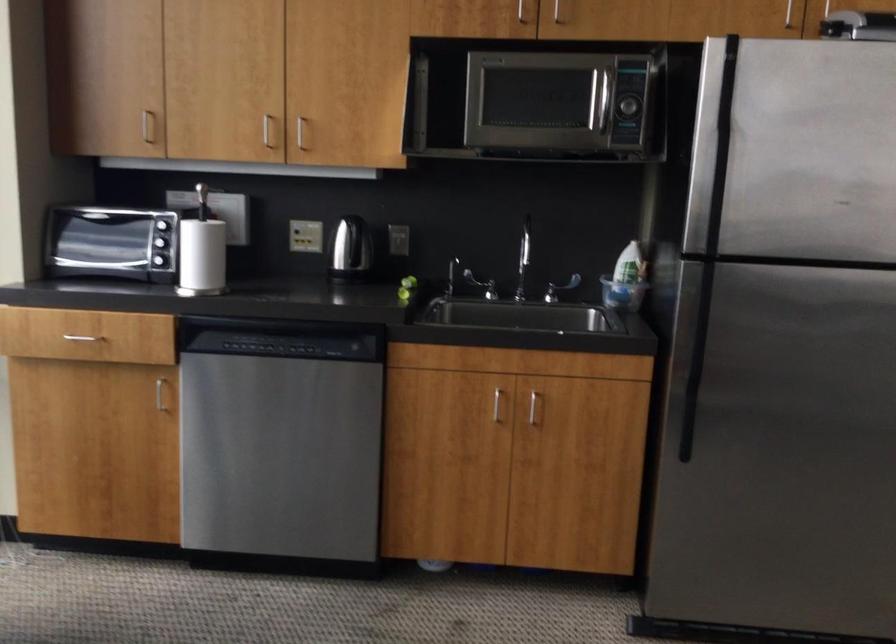
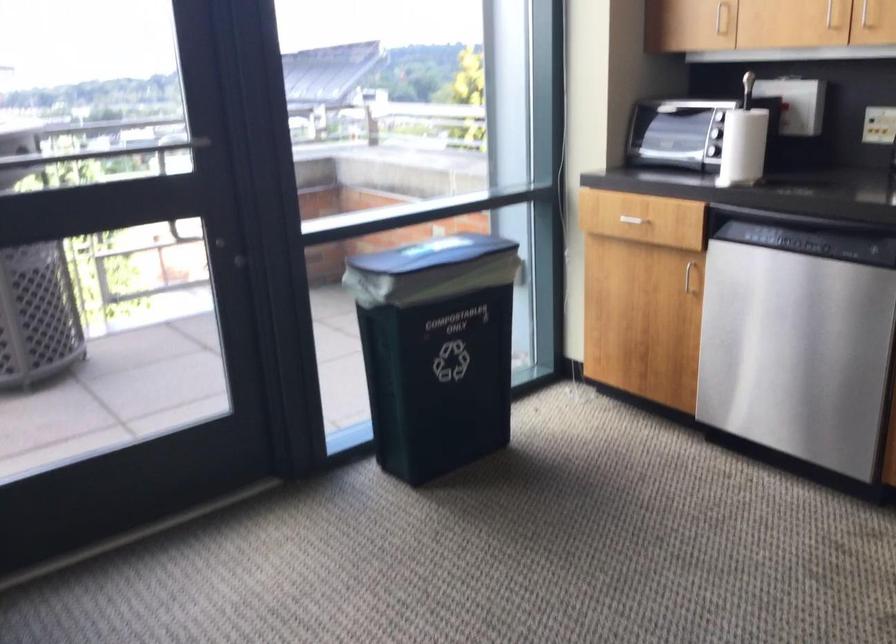
Where in the second image is the point corresponding to point 295,138 from the first image?

(865, 15)